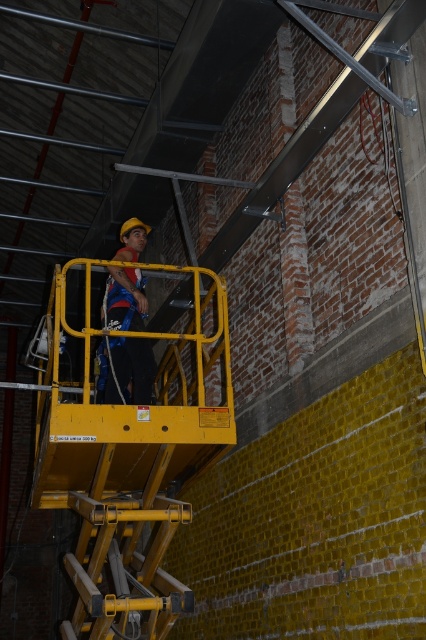
You are a safety inspector checking the construction site. You notice the yellow metallic platform at center and the matte blue safety harness at center. According to safety protocols, the safety harness should be above the platform. Is this setup compliant with safety standards?

The yellow metallic platform at center is positioned under the matte blue safety harness at center, which means the harness is above the platform. This setup complies with safety standards as the safety harness is correctly placed above the platform.

You are a construction worker standing at the base of the yellow scissor lift in the image. You need to determine which of the two points, point (170, 394) or point (132, 300), is closer to you. Which point is nearer?

Point (132, 300) is closer to you because it is less further to the camera than point (170, 394).

You are a safety inspector evaluating the construction site shown. You notice the yellow metallic platform at center and the matte blue safety harness at center. Which object is positioned closer to your viewpoint?

The yellow metallic platform at center is closer to the viewer than the matte blue safety harness at center, so the platform is closer.